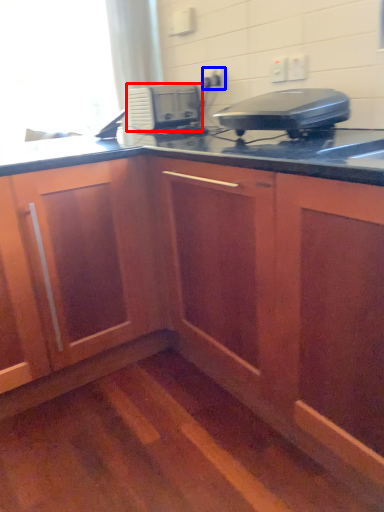
Question: Which point is closer to the camera, home appliance (highlighted by a red box) or electric outlet (highlighted by a blue box)?

Choices:
 (A) home appliance
 (B) electric outlet

Answer: (A)